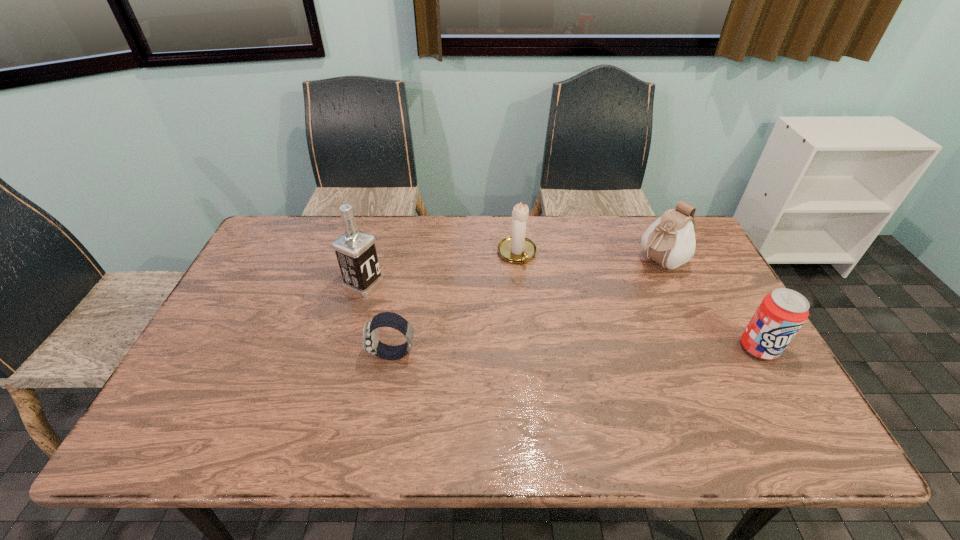
This screenshot has width=960, height=540. Identify the location of free space on the desktop that is between the shortest object and the rightmost object and is positioned on the front-facing side of the fourth object from left to right. (545, 352).

I want to click on vacant spot on the desktop that is between the shortest object and the rightmost object and is positioned on the handle side of the candle holder, so click(567, 352).

The image size is (960, 540). I want to click on free space on the desktop that is between the watch and the soda can and is positioned on the front label of the tallest object, so click(x=524, y=352).